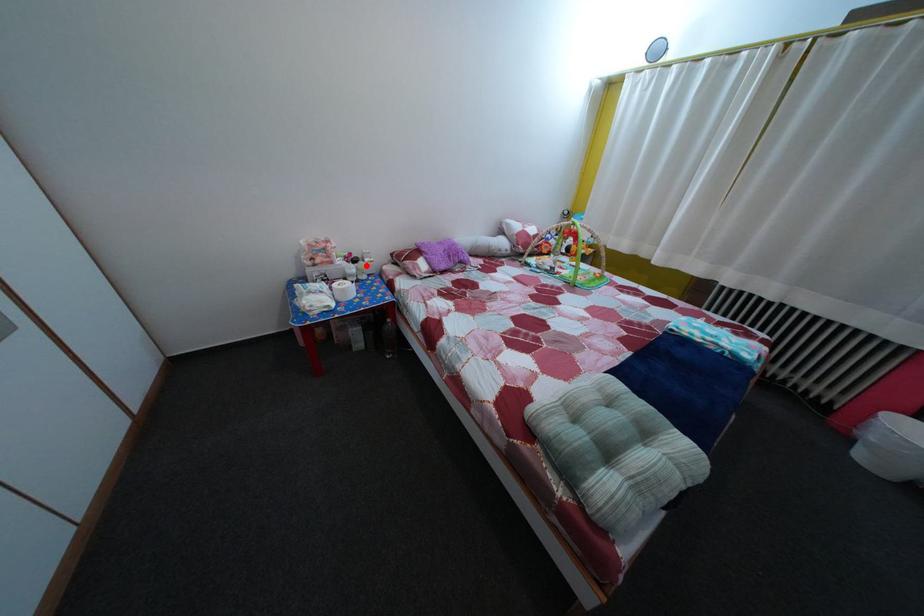
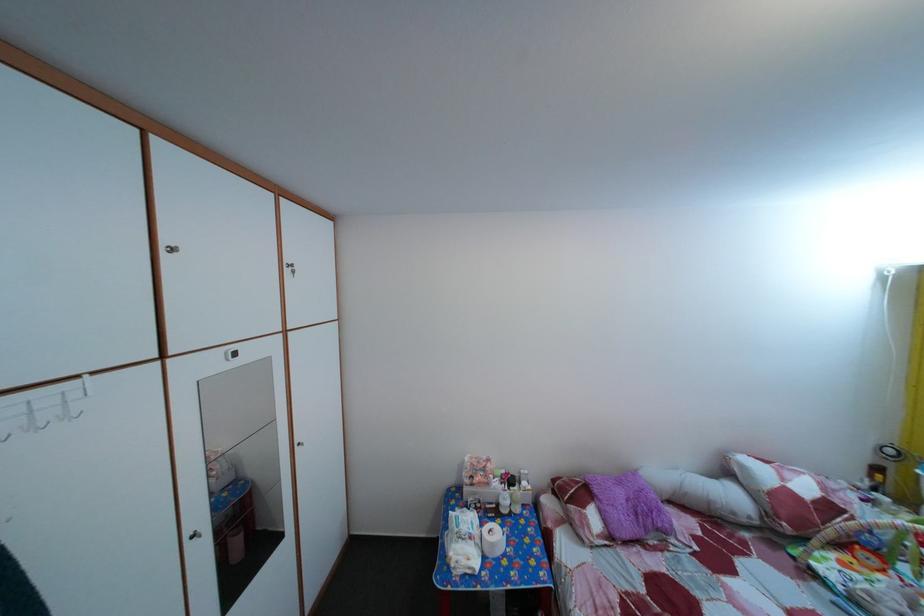
Find the pixel in the second image that matches the highlighted location in the first image.

(524, 485)